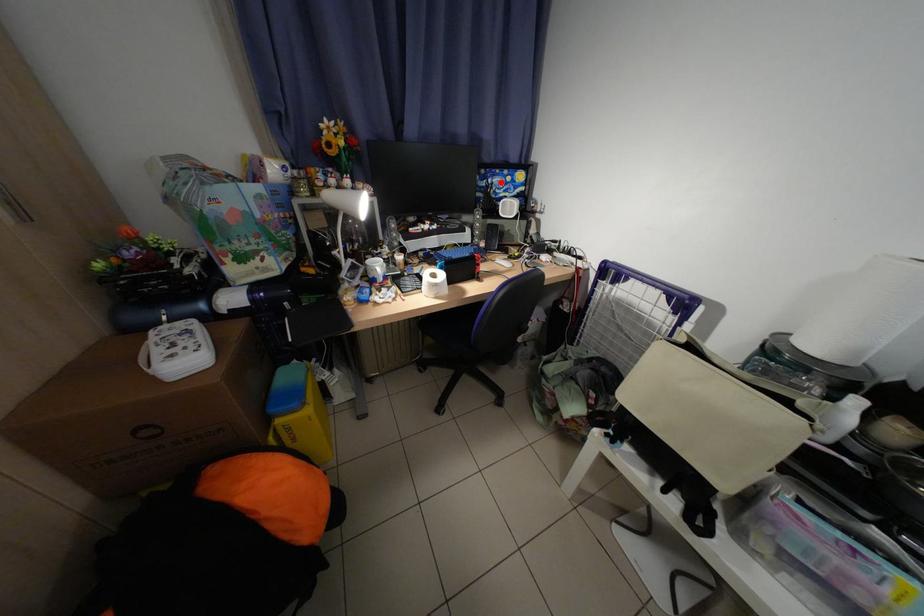
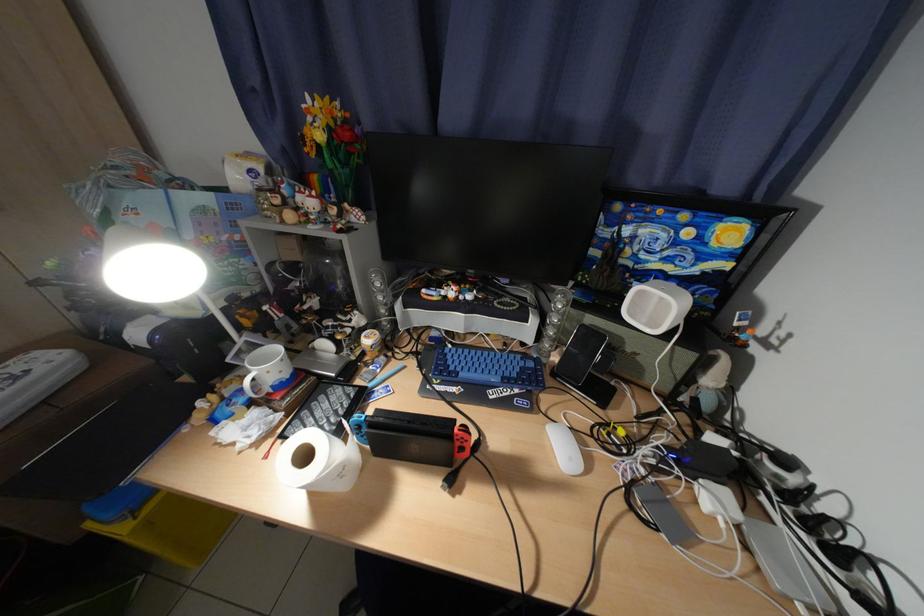
Where in the second image is the point corresponding to the highlighted location from the first image?

(638, 233)